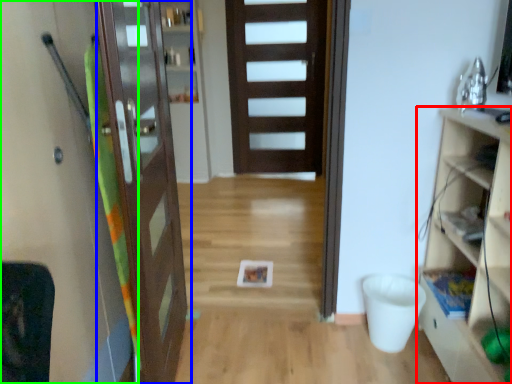
Question: Considering the real-world distances, which object is closest to cabinetry (highlighted by a red box)? door (highlighted by a blue box) or screen door (highlighted by a green box).

Choices:
 (A) door
 (B) screen door

Answer: (A)